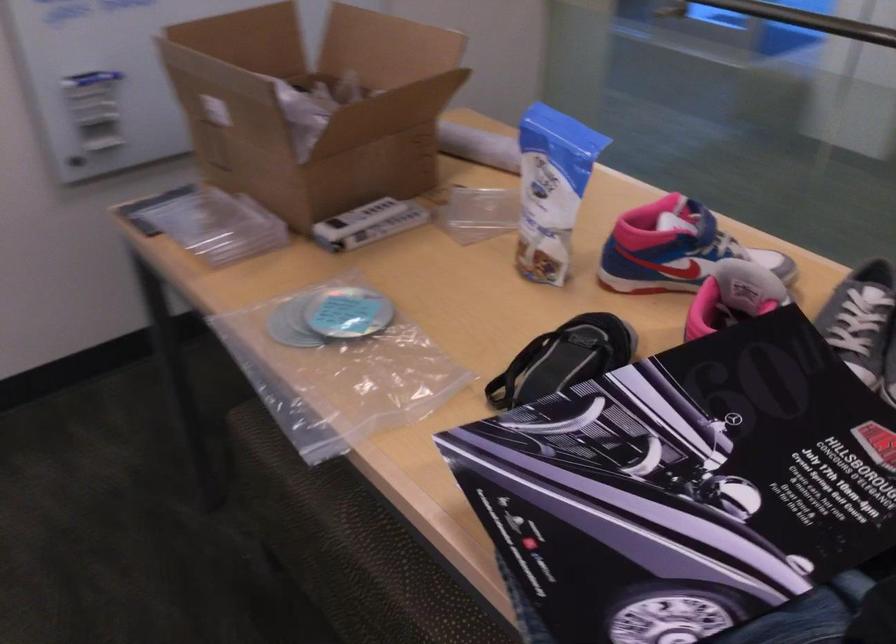
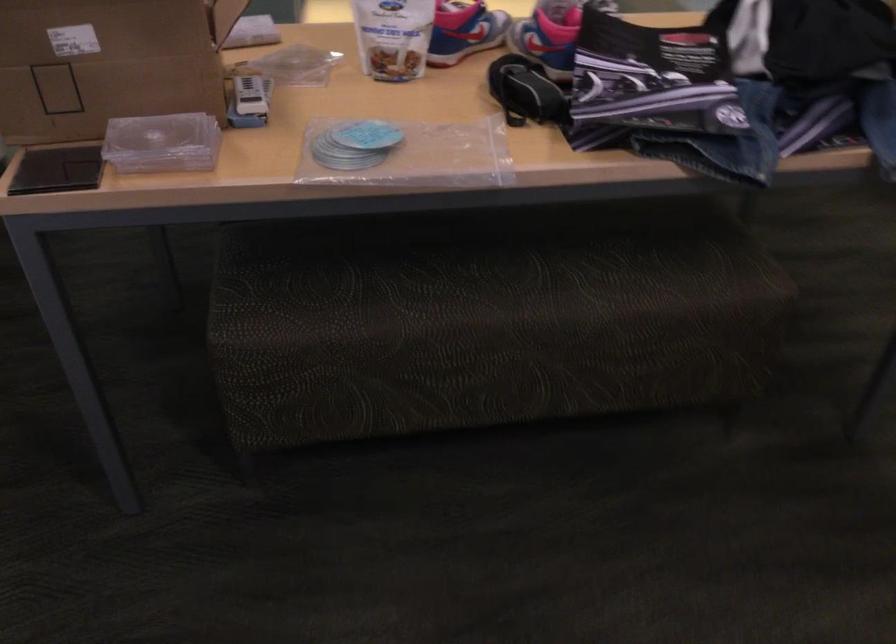
In the second image, find the point that corresponds to the point at 342,365 in the first image.

(415, 156)